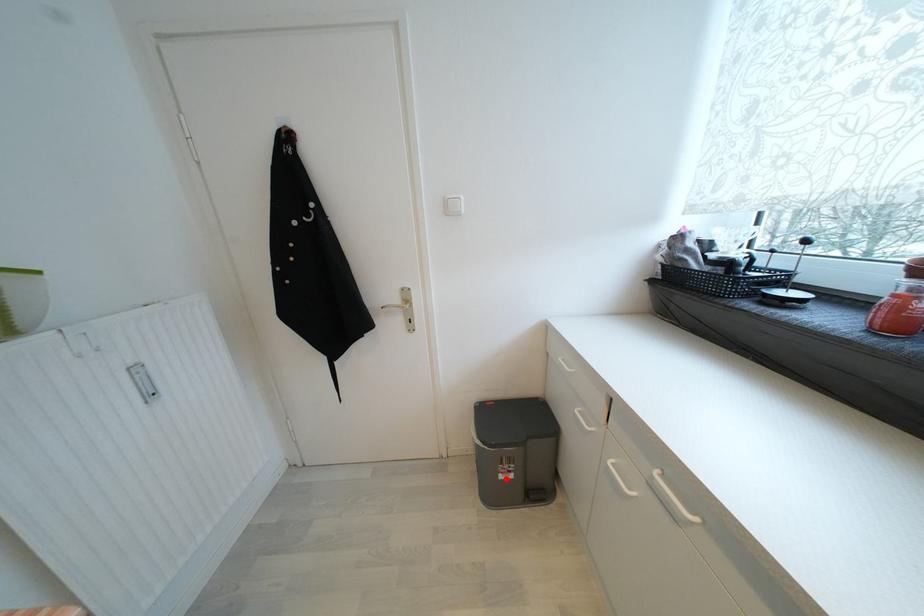
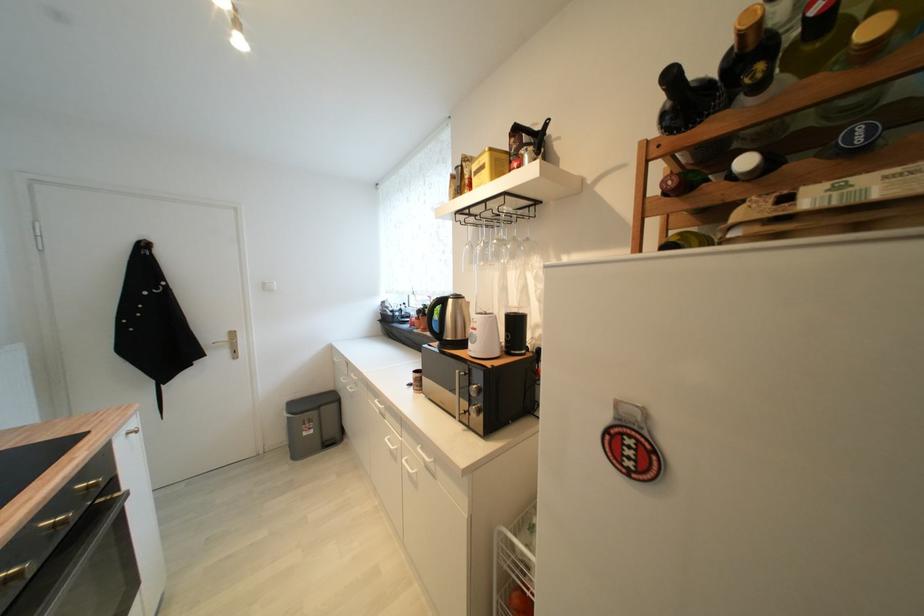
Find the pixel in the second image that matches the highlighted location in the first image.

(310, 436)